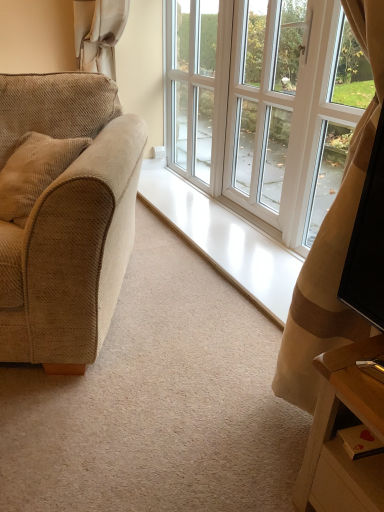
You are a GUI agent. You are given a task and a screenshot of the screen. Output one action in this format:
    pyautogui.click(x=<x>, y=<y>)
    Task: Click on the vacant space to the right of beige corduroy couch at left
    The width and height of the screenshot is (384, 512).
    Given the screenshot: What is the action you would take?
    pyautogui.click(x=182, y=324)